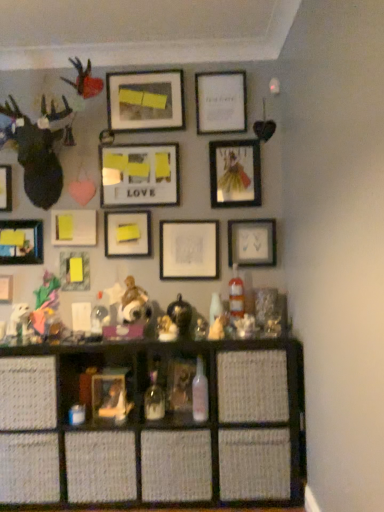
Question: From the image's perspective, is white paper at upper center, the 10th picture frame positioned from the left, below matte black picture frame at upper center, which is the fifth picture frame in right-to-left order?

Choices:
 (A) yes
 (B) no

Answer: (A)

Question: From the image's perspective, does white paper at upper center, the 10th picture frame positioned from the left, appear higher than matte black picture frame at upper center, which is the fifth picture frame in right-to-left order?

Choices:
 (A) no
 (B) yes

Answer: (A)

Question: Is matte black picture frame at upper center, the eighth picture frame in the left-to-right sequence, surrounded by white paper at upper center, acting as the 3th picture frame starting from the right?

Choices:
 (A) yes
 (B) no

Answer: (B)

Question: Does white paper at upper center, the 10th picture frame positioned from the left, have a larger size compared to matte black picture frame at upper center, which is the fifth picture frame in right-to-left order?

Choices:
 (A) no
 (B) yes

Answer: (A)

Question: Can you confirm if white paper at upper center, the 10th picture frame positioned from the left, is positioned to the left of matte black picture frame at upper center, which is the fifth picture frame in right-to-left order?

Choices:
 (A) no
 (B) yes

Answer: (A)

Question: Is matte wooden picture frame at center, which is counted as the 7th picture frame, starting from the left, spatially inside matte glass picture frame at center-right, which appears as the 1th picture frame when viewed from the right, or outside of it?

Choices:
 (A) outside
 (B) inside

Answer: (A)

Question: Visually, is matte wooden picture frame at center, positioned as the 6th picture frame in right-to-left order, positioned to the left or to the right of matte glass picture frame at center-right, the twelfth picture frame viewed from the left?

Choices:
 (A) right
 (B) left

Answer: (B)

Question: In terms of width, does matte wooden picture frame at center, which is counted as the 7th picture frame, starting from the left, look wider or thinner when compared to matte glass picture frame at center-right, which appears as the 1th picture frame when viewed from the right?

Choices:
 (A) wide
 (B) thin

Answer: (B)

Question: From the image's perspective, is matte wooden picture frame at center, positioned as the 6th picture frame in right-to-left order, positioned above or below matte glass picture frame at center-right, which appears as the 1th picture frame when viewed from the right?

Choices:
 (A) below
 (B) above

Answer: (B)

Question: Is woven wood shelf at lower center inside the boundaries of matte black picture frame at left, acting as the twelfth picture frame starting from the right, or outside?

Choices:
 (A) inside
 (B) outside

Answer: (B)

Question: Looking at their shapes, would you say woven wood shelf at lower center is wider or thinner than matte black picture frame at left, acting as the 1th picture frame starting from the left?

Choices:
 (A) wide
 (B) thin

Answer: (A)

Question: In the image, is woven wood shelf at lower center positioned in front of or behind matte black picture frame at left, acting as the 1th picture frame starting from the left?

Choices:
 (A) behind
 (B) front

Answer: (B)

Question: From the image's perspective, is woven wood shelf at lower center positioned above or below matte black picture frame at left, acting as the 1th picture frame starting from the left?

Choices:
 (A) below
 (B) above

Answer: (A)

Question: Looking at their shapes, would you say matte black picture frame at upper center, which is the fifth picture frame in right-to-left order, is wider or thinner than matte black picture frame at left, acting as the twelfth picture frame starting from the right?

Choices:
 (A) wide
 (B) thin

Answer: (A)

Question: Is matte black picture frame at upper center, which is the fifth picture frame in right-to-left order, spatially inside matte black picture frame at left, acting as the 1th picture frame starting from the left, or outside of it?

Choices:
 (A) outside
 (B) inside

Answer: (A)